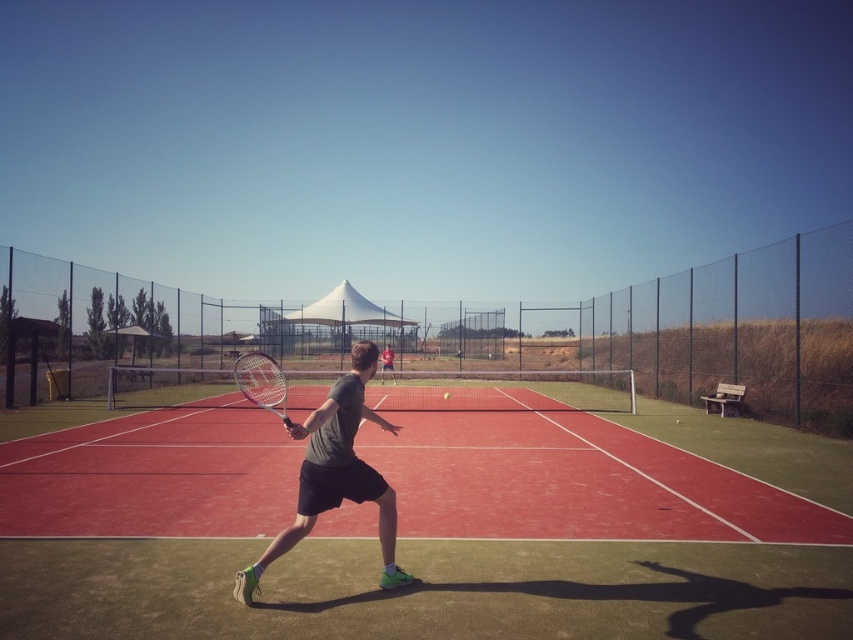
You are a tennis ball currently in flight near the gray matte tennis racket at center. Considering the red rubber tennis court at center is lower than the racket, will you land on the court or hit the racket?

The red rubber tennis court at center is lower than the gray matte tennis racket at center, so the tennis ball will land on the court instead of hitting the racket.

You are a tennis coach observing a player hitting a ball. The player has a gray matte tennis racket at center and a yellow rubber tennis ball at center. Which object is closer to the left side of the court?

The gray matte tennis racket at center is positioned on the left side of the yellow rubber tennis ball at center, so it is closer to the left side of the court.

You are a tennis ball currently in flight near the gray matte tennis racket at center. Can you land on the red rubber tennis court at center without bouncing off the fence first?

The red rubber tennis court at center is wider than the gray matte tennis racket at center, so yes, the tennis ball can land on the red rubber tennis court at center without hitting the fence first.